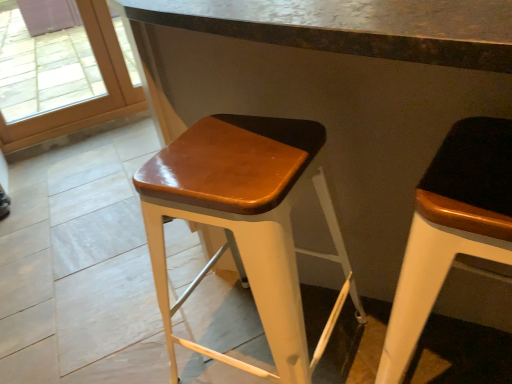
Question: In terms of width, does transparent glass door at upper left look wider or thinner when compared to glossy wood stool at center, acting as the second stool starting from the right?

Choices:
 (A) wide
 (B) thin

Answer: (B)

Question: Considering the positions of transparent glass door at upper left and glossy wood stool at center, acting as the second stool starting from the right, in the image, is transparent glass door at upper left taller or shorter than glossy wood stool at center, acting as the second stool starting from the right,?

Choices:
 (A) short
 (B) tall

Answer: (B)

Question: Estimate the real-world distances between objects in this image. Which object is closer to the glossy wood stool at center, acting as the second stool starting from the right?

Choices:
 (A) matte black stool at right, the 1th stool positioned from the right
 (B) transparent glass door at upper left

Answer: (A)

Question: Which object is positioned farthest from the transparent glass door at upper left?

Choices:
 (A) glossy wood stool at center, which ranks as the 1th stool in left-to-right order
 (B) matte black stool at right, the 1th stool positioned from the right

Answer: (B)